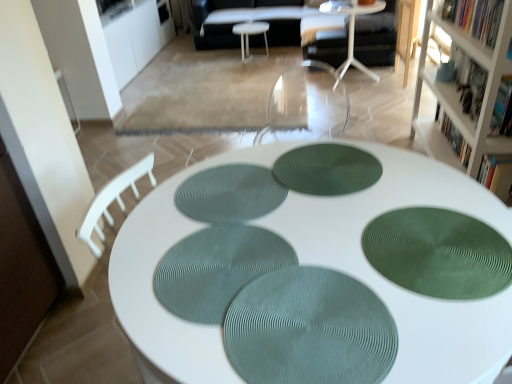
This screenshot has width=512, height=384. I want to click on free region on the left part of green textured mat at lower right, marked as the first mat in a right-to-left arrangement, so pyautogui.click(x=313, y=266).